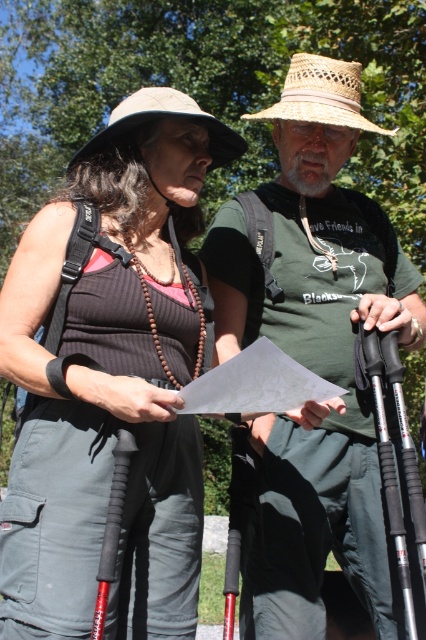
Is matte black vest at center to the left of natural straw hat at upper center from the viewer's perspective?

Incorrect, matte black vest at center is not on the left side of natural straw hat at upper center.

Does matte black vest at center have a smaller size compared to natural straw hat at upper center?

Indeed, matte black vest at center has a smaller size compared to natural straw hat at upper center.

Image resolution: width=426 pixels, height=640 pixels. Find the location of `matte black vest at center`. matte black vest at center is located at coordinates (112, 381).

Locate an element on the screen. matte black vest at center is located at coordinates (112, 381).

Does green cotton shirt at center appear over woven straw hat at upper center?

No, green cotton shirt at center is not above woven straw hat at upper center.

Where is `green cotton shirt at center`? Image resolution: width=426 pixels, height=640 pixels. green cotton shirt at center is located at coordinates (313, 360).